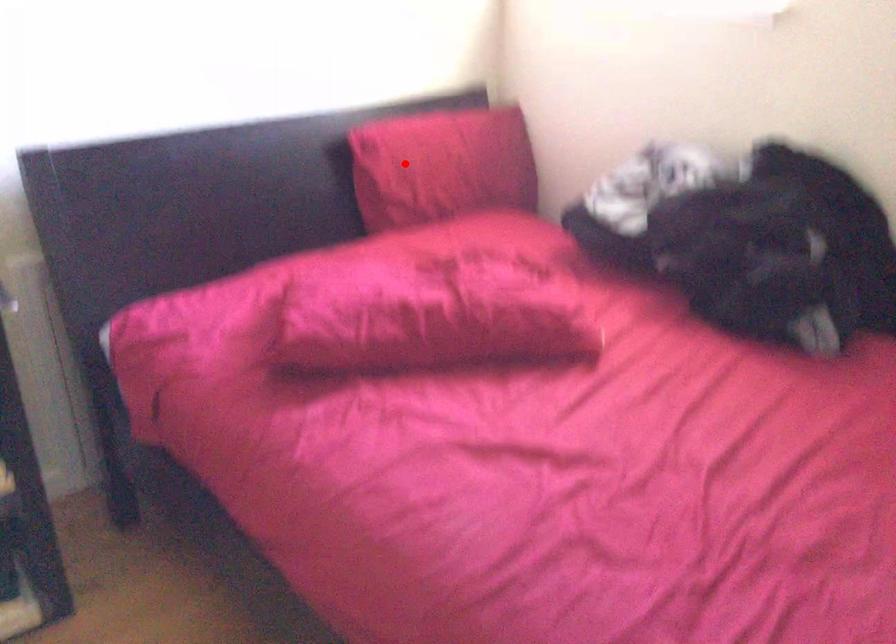
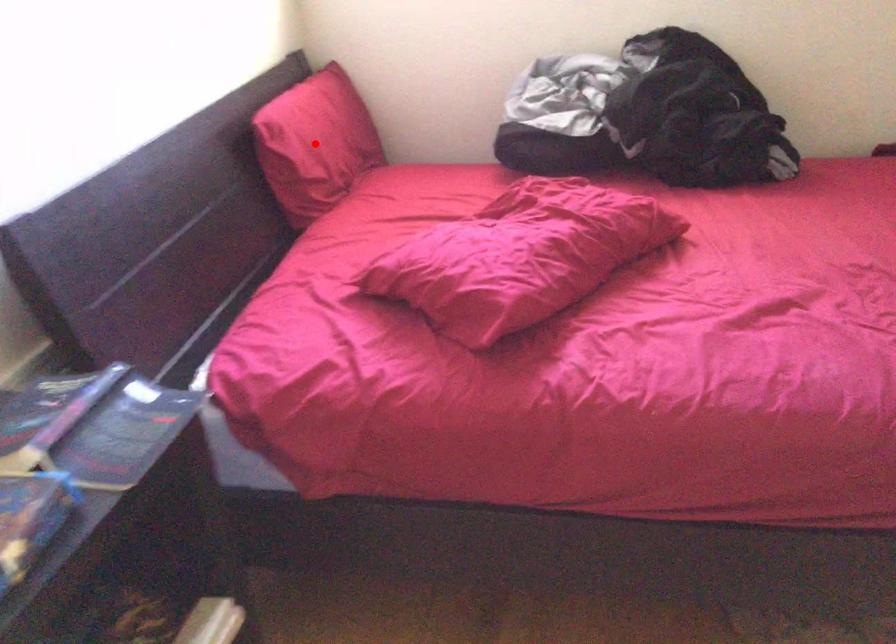
I am providing you with two images of the same scene from different viewpoints. A red point is marked on the first image and another point is marked on the second image. Is the red point in image1 aligned with the point shown in image2?

Yes